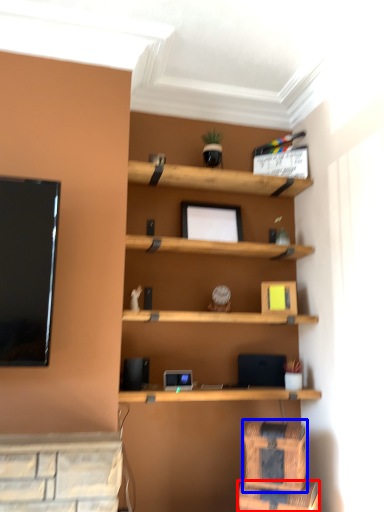
Question: Which object appears closest to the camera in this image, drawer (highlighted by a red box) or drawer (highlighted by a blue box)?

Choices:
 (A) drawer
 (B) drawer

Answer: (A)